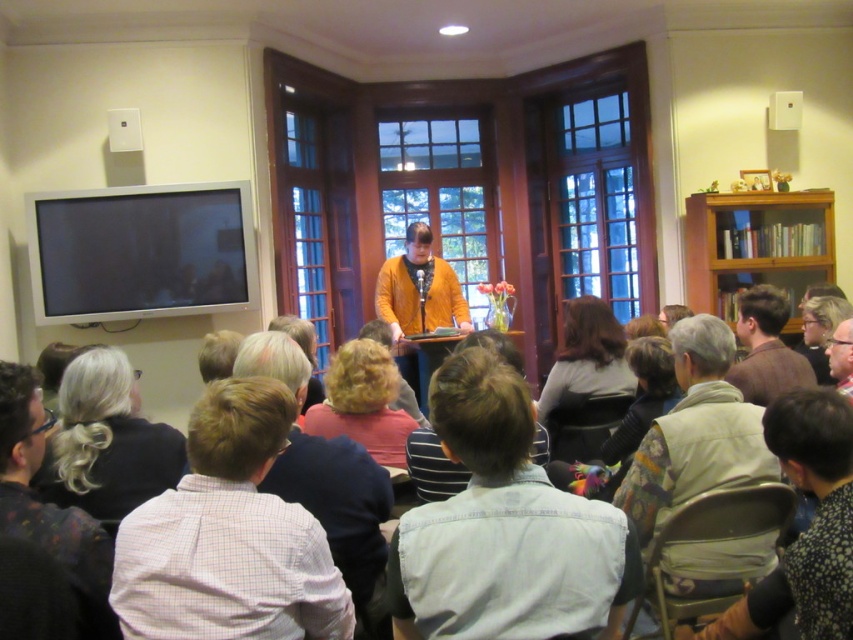
Which is above, white checkered shirt at lower left or dark brown hair at center?

Positioned higher is dark brown hair at center.

Which is more to the left, white checkered shirt at lower left or dark brown hair at center?

white checkered shirt at lower left is more to the left.

This screenshot has width=853, height=640. What are the coordinates of `white checkered shirt at lower left` in the screenshot? It's located at (338, 502).

What are the coordinates of `white checkered shirt at lower left` in the screenshot? It's located at (338, 502).

Can you confirm if denim shirt at lower center is positioned to the left of blonde hair at center?

In fact, denim shirt at lower center is to the right of blonde hair at center.

Does point (402, 620) lie behind point (397, 371)?

No.

You are a GUI agent. You are given a task and a screenshot of the screen. Output one action in this format:
    pyautogui.click(x=<x>, y=<y>)
    Task: Click on the denim shirt at lower center
    
    Given the screenshot: What is the action you would take?
    pyautogui.click(x=503, y=529)

Between light gray checkered shirt at lower left and floral-patterned shirt at lower right, which one appears on the left side from the viewer's perspective?

light gray checkered shirt at lower left

Between point (268, 564) and point (706, 632), which one is positioned in front?

Point (268, 564) is more forward.

Locate an element on the screen. light gray checkered shirt at lower left is located at coordinates (229, 536).